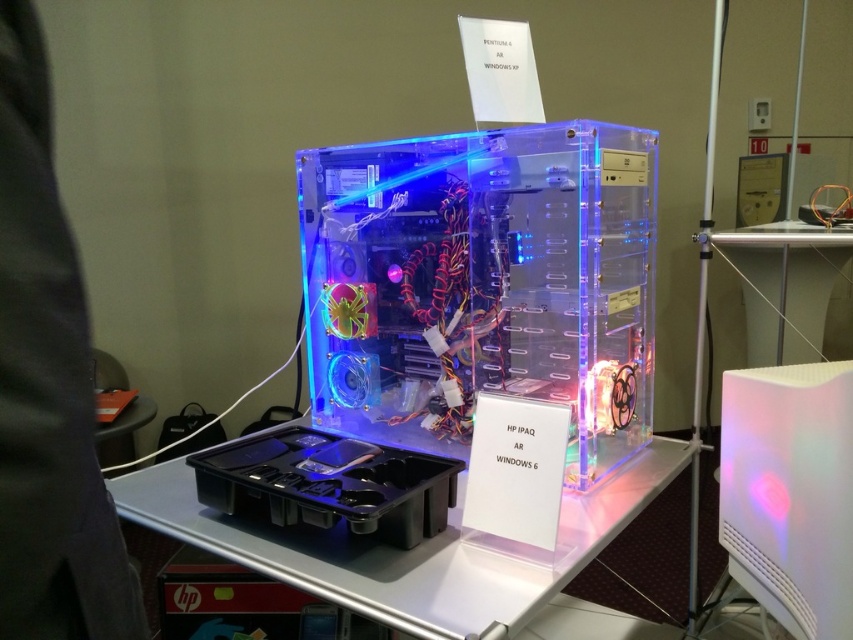
Is point (303, 486) behind point (779, 305)?

No, it is in front of (779, 305).

Is point (360, 461) closer to camera compared to point (805, 264)?

Yes.

This screenshot has height=640, width=853. I want to click on translucent plastic tray at center, so click(x=329, y=483).

Locate an element on the screen. translucent plastic tray at center is located at coordinates (329, 483).

Between point (625, 500) and point (821, 353), which one is positioned behind?

The point (821, 353) is behind.

Does clear plastic tray at center have a greater width compared to white glossy table at center?

Yes, clear plastic tray at center is wider than white glossy table at center.

The image size is (853, 640). What are the coordinates of `clear plastic tray at center` in the screenshot? It's located at (408, 550).

Can you confirm if clear plastic tray at center is bigger than translucent plastic tray at center?

Correct, clear plastic tray at center is larger in size than translucent plastic tray at center.

From the picture: Can you confirm if clear plastic tray at center is taller than translucent plastic tray at center?

Indeed, clear plastic tray at center has a greater height compared to translucent plastic tray at center.

Image resolution: width=853 pixels, height=640 pixels. Find the location of `clear plastic tray at center`. clear plastic tray at center is located at coordinates (408, 550).